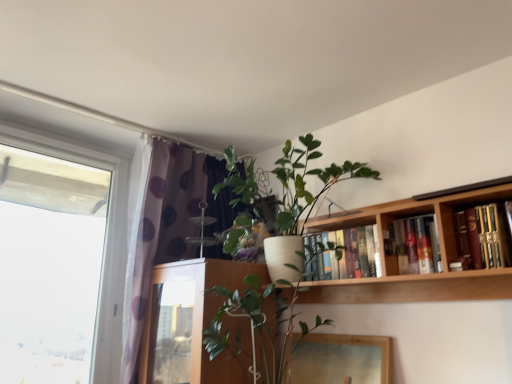
Question: From a real-world perspective, is purple dotted fabric at left positioned over wooden bookshelf at upper right based on gravity?

Choices:
 (A) no
 (B) yes

Answer: (B)

Question: Is purple dotted fabric at left facing away from wooden bookshelf at upper right?

Choices:
 (A) no
 (B) yes

Answer: (A)

Question: Does purple dotted fabric at left have a greater height compared to wooden bookshelf at upper right?

Choices:
 (A) yes
 (B) no

Answer: (A)

Question: From the image's perspective, is purple dotted fabric at left on wooden bookshelf at upper right?

Choices:
 (A) no
 (B) yes

Answer: (A)

Question: Is purple dotted fabric at left touching wooden bookshelf at upper right?

Choices:
 (A) yes
 (B) no

Answer: (B)

Question: In the image, is white matte pot at upper center, placed as the second houseplant when sorted from bottom to top, positioned in front of or behind hardcover books at upper center, which appears as the 1th book when viewed from the back?

Choices:
 (A) behind
 (B) front

Answer: (B)

Question: Based on their positions, is white matte pot at upper center, the first houseplant from the top, located to the left or right of hardcover books at upper center, acting as the 1th book starting from the left?

Choices:
 (A) left
 (B) right

Answer: (A)

Question: Is white matte pot at upper center, placed as the second houseplant when sorted from bottom to top, bigger or smaller than hardcover books at upper center, which is the third book from front to back?

Choices:
 (A) big
 (B) small

Answer: (A)

Question: From a real-world perspective, is white matte pot at upper center, the first houseplant from the top, positioned above or below hardcover books at upper center, acting as the 1th book starting from the left?

Choices:
 (A) below
 (B) above

Answer: (B)

Question: Looking at their shapes, would you say white ceramic pot at center, arranged as the first houseplant when ordered from the bottom, is wider or thinner than hardcover books at upper right, positioned as the 2th book in front-to-back order?

Choices:
 (A) wide
 (B) thin

Answer: (A)

Question: In terms of height, does white ceramic pot at center, which is the 2th houseplant in top-to-bottom order, look taller or shorter compared to hardcover books at upper right, positioned as the 2th book in front-to-back order?

Choices:
 (A) tall
 (B) short

Answer: (A)

Question: Is white ceramic pot at center, which is the 2th houseplant in top-to-bottom order, spatially inside hardcover books at upper right, positioned as the 2th book in front-to-back order, or outside of it?

Choices:
 (A) inside
 (B) outside

Answer: (B)

Question: From a real-world perspective, relative to hardcover books at upper right, positioned as the 2th book in front-to-back order, is white ceramic pot at center, arranged as the first houseplant when ordered from the bottom, vertically above or below?

Choices:
 (A) below
 (B) above

Answer: (A)

Question: From the image's perspective, is hardcover books at upper right, positioned as the first book in front-to-back order, positioned above or below hardcover books at upper right, the 2th book viewed from the right?

Choices:
 (A) below
 (B) above

Answer: (B)

Question: Do you think hardcover books at upper right, placed as the 3th book when sorted from left to right, is within hardcover books at upper right, the 2th book viewed from the right, or outside of it?

Choices:
 (A) outside
 (B) inside

Answer: (A)